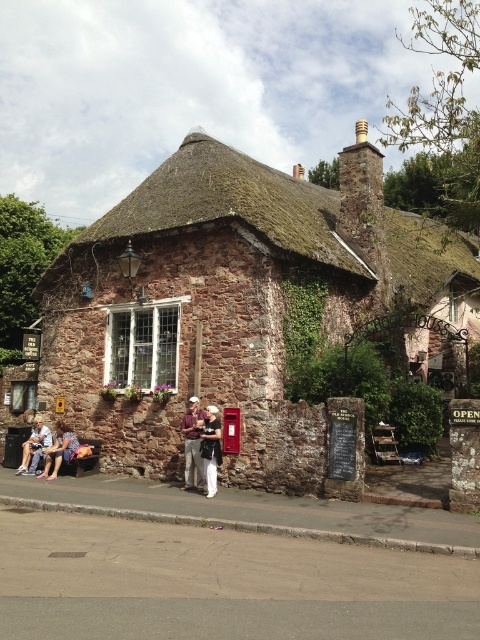
Question: Observing the image, what is the correct spatial positioning of brown leather jacket at center in reference to white cotton shirt at center?

Choices:
 (A) left
 (B) right

Answer: (A)

Question: Is white cotton shirt at center behind denim jacket at lower left?

Choices:
 (A) no
 (B) yes

Answer: (A)

Question: Which of these objects is positioned closest to the brown leather jacket at center?

Choices:
 (A) rustic stone cottage at center
 (B) denim shorts at lower left

Answer: (B)

Question: Is brown leather jacket at center to the right of white cotton shirt at center from the viewer's perspective?

Choices:
 (A) yes
 (B) no

Answer: (B)

Question: Which point is farther to the camera?

Choices:
 (A) brown leather jacket at center
 (B) denim shorts at lower left
 (C) rustic stone cottage at center
 (D) denim jacket at lower left

Answer: (D)

Question: Estimate the real-world distances between objects in this image. Which object is farther from the brown leather jacket at center?

Choices:
 (A) denim shorts at lower left
 (B) rustic stone cottage at center
 (C) denim jacket at lower left

Answer: (B)